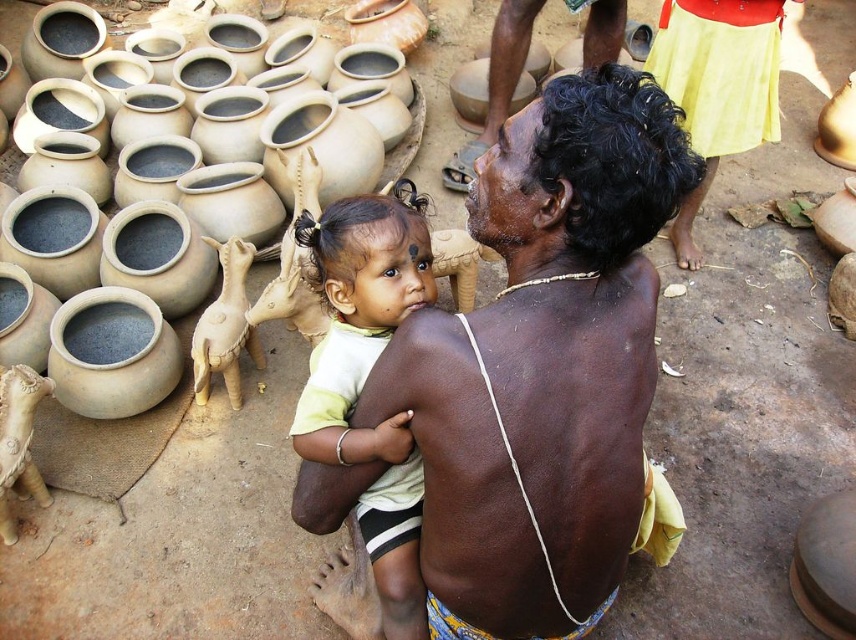
Locate an element on the screen. brown skin man at center is located at coordinates [544, 364].

Does brown skin man at center come behind matte clay pot at left?

No, brown skin man at center is in front of matte clay pot at left.

Does point (589, 564) come behind point (421, 104)?

No, it is in front of (421, 104).

Where is `brown skin man at center`? The height and width of the screenshot is (640, 856). brown skin man at center is located at coordinates (544, 364).

Is brown skin man at center below matte yellow shirt at center?

No.

Is brown skin man at center to the left of matte yellow shirt at center from the viewer's perspective?

No, brown skin man at center is not to the left of matte yellow shirt at center.

Is point (453, 413) closer to viewer compared to point (355, 362)?

Yes, point (453, 413) is closer to viewer.

At what (x,y) coordinates should I click in order to perform the action: click on brown skin man at center. Please return your answer as a coordinate pair (x, y). Image resolution: width=856 pixels, height=640 pixels. Looking at the image, I should click on (544, 364).

Between yellow cotton skirt at upper right and matte clay pot at left, which one appears on the right side from the viewer's perspective?

yellow cotton skirt at upper right is more to the right.

Does point (682, 228) lie behind point (10, 150)?

No.

Is point (764, 76) farther from viewer compared to point (401, 154)?

No, (764, 76) is closer to viewer.

Find the location of a particular element. The image size is (856, 640). yellow cotton skirt at upper right is located at coordinates (717, 84).